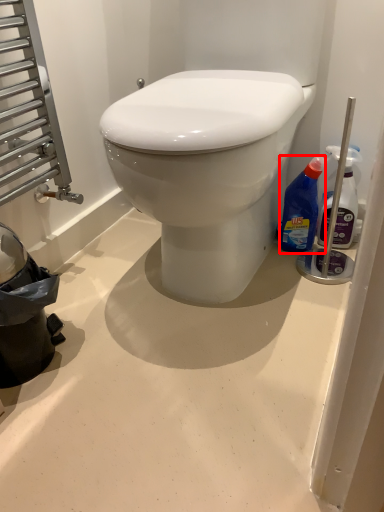
Question: Observing the image, what is the correct spatial positioning of bottle (annotated by the red box) in reference to bottle?

Choices:
 (A) right
 (B) left

Answer: (B)